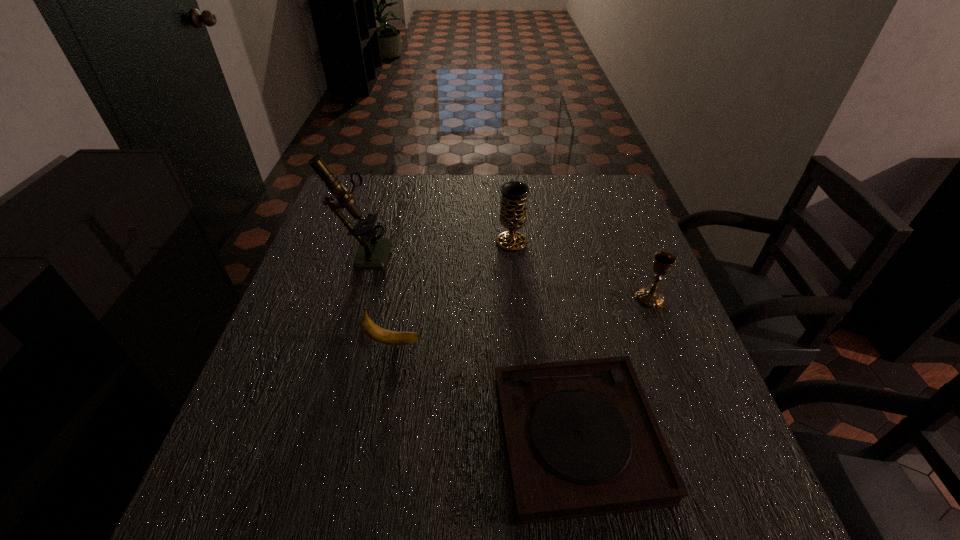
The height and width of the screenshot is (540, 960). Find the location of `object that ranks as the closest to the right chalice`. object that ranks as the closest to the right chalice is located at coordinates (581, 440).

The image size is (960, 540). In order to click on object that is the nearest to the tallest object in this screenshot , I will do `click(370, 329)`.

At what (x,y) coordinates should I click in order to perform the action: click on vacant area that satisfies the following two spatial constraints: 1. on the front side of the shorter chalice; 2. at the start of the peel on the banana. Please return your answer as a coordinate pair (x, y). This screenshot has height=540, width=960. Looking at the image, I should click on (667, 343).

The image size is (960, 540). In order to click on vacant space that satisfies the following two spatial constraints: 1. at the eyepiece of the phonograph record; 2. on the right side of the tallest object in this screenshot , I will do `click(307, 437)`.

Find the location of a particular element. free spot that satisfies the following two spatial constraints: 1. at the eyepiece of the shorter chalice; 2. on the right side of the microscope is located at coordinates (349, 299).

Locate an element on the screen. The image size is (960, 540). vacant area that satisfies the following two spatial constraints: 1. on the back side of the shortest object; 2. at the start of the peel on the fourth farthest object is located at coordinates (562, 343).

Where is `vacant area in the image that satisfies the following two spatial constraints: 1. at the eyepiece of the tallest object; 2. on the left side of the right chalice`? The width and height of the screenshot is (960, 540). vacant area in the image that satisfies the following two spatial constraints: 1. at the eyepiece of the tallest object; 2. on the left side of the right chalice is located at coordinates (349, 299).

Identify the location of free spot that satisfies the following two spatial constraints: 1. at the eyepiece of the microscope; 2. on the left side of the rightmost object. The image size is (960, 540). 349,299.

At what (x,y) coordinates should I click in order to perform the action: click on free space in the image that satisfies the following two spatial constraints: 1. on the front side of the left chalice; 2. on the right side of the right chalice. Please return your answer as a coordinate pair (x, y). This screenshot has width=960, height=540. Looking at the image, I should click on (516, 299).

You are a GUI agent. You are given a task and a screenshot of the screen. Output one action in this format:
    pyautogui.click(x=<x>, y=<y>)
    Task: Click on the vacant space that satisfies the following two spatial constraints: 1. at the eyepiece of the microscope; 2. on the back side of the nearest object
    This screenshot has height=540, width=960.
    Given the screenshot: What is the action you would take?
    pyautogui.click(x=307, y=437)